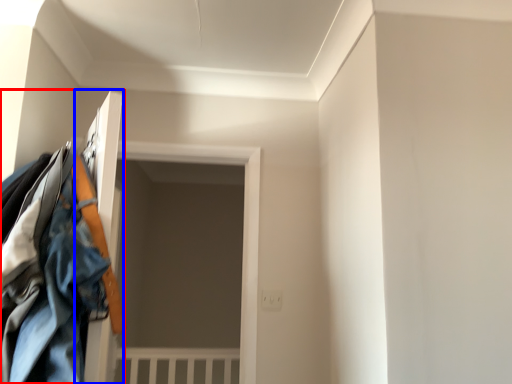
Question: Which point is further to the camera, closet (highlighted by a red box) or door (highlighted by a blue box)?

Choices:
 (A) closet
 (B) door

Answer: (B)